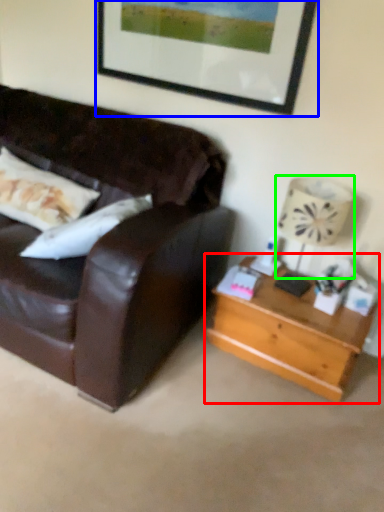
Question: Based on their relative distances, which object is nearer to table (highlighted by a red box)? Choose from picture frame (highlighted by a blue box) and lamp (highlighted by a green box).

Choices:
 (A) picture frame
 (B) lamp

Answer: (B)